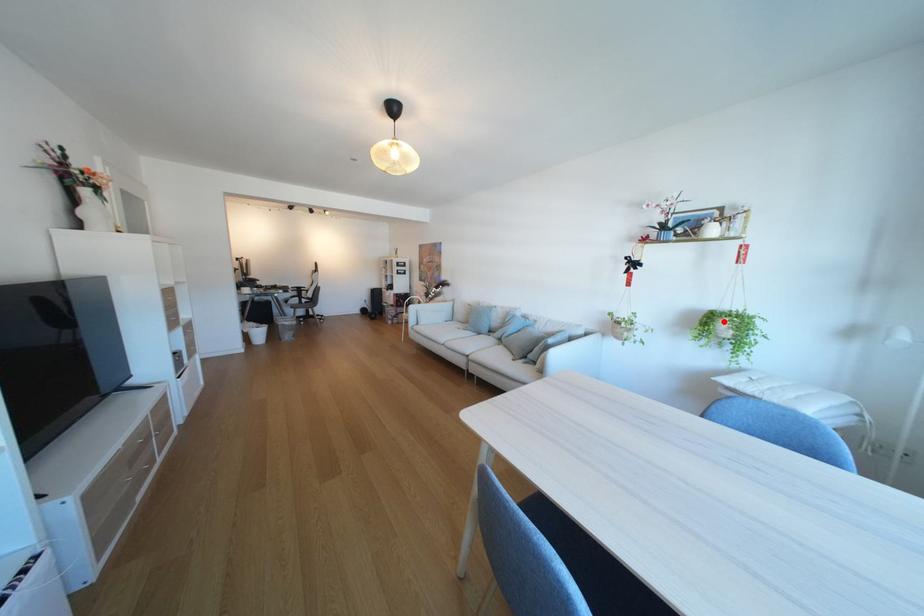
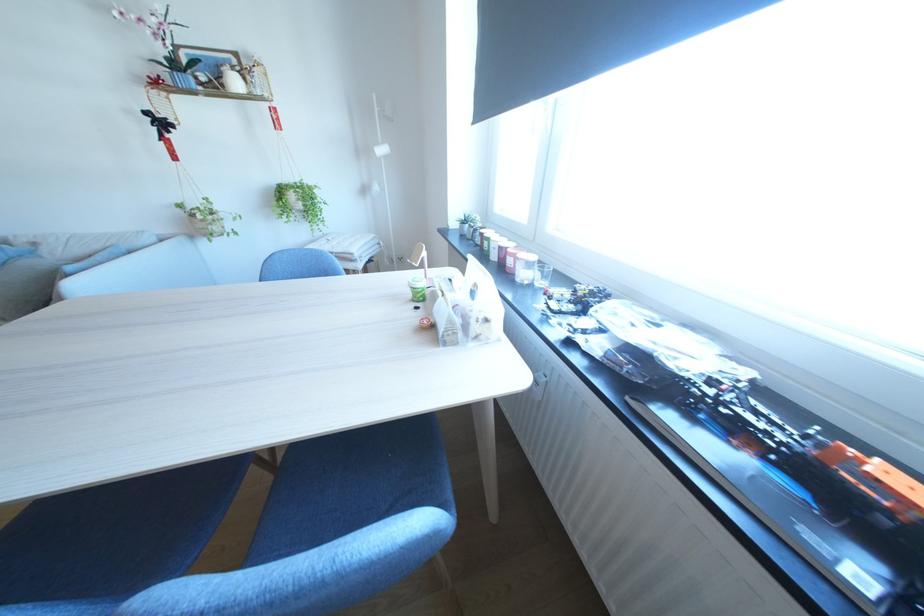
Question: A red point is marked in image1. In image2, is the corresponding 3D point closer to the camera or farther? Reply with the corresponding letter.

Choices:
 (A) The corresponding 3D point is closer.
 (B) The corresponding 3D point is farther.

Answer: (A)